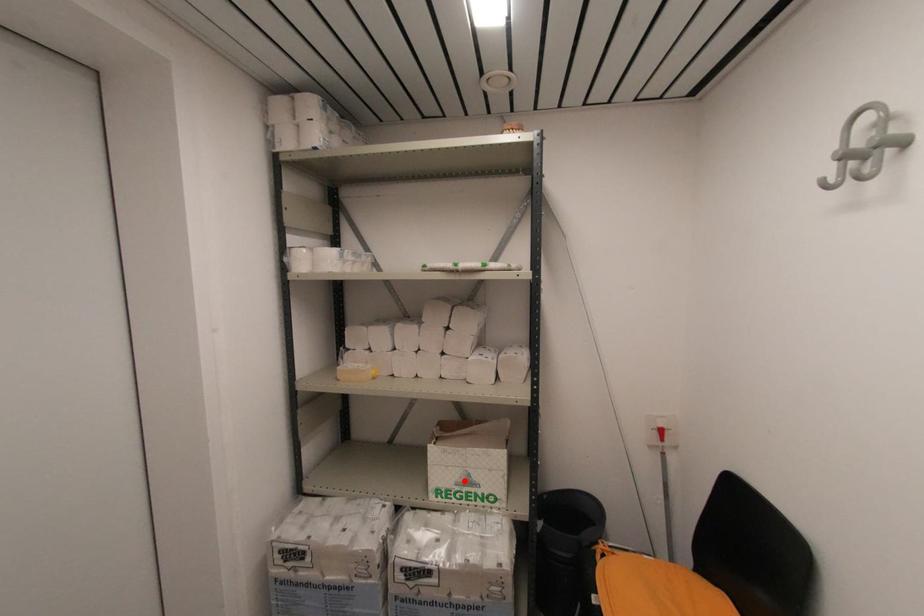
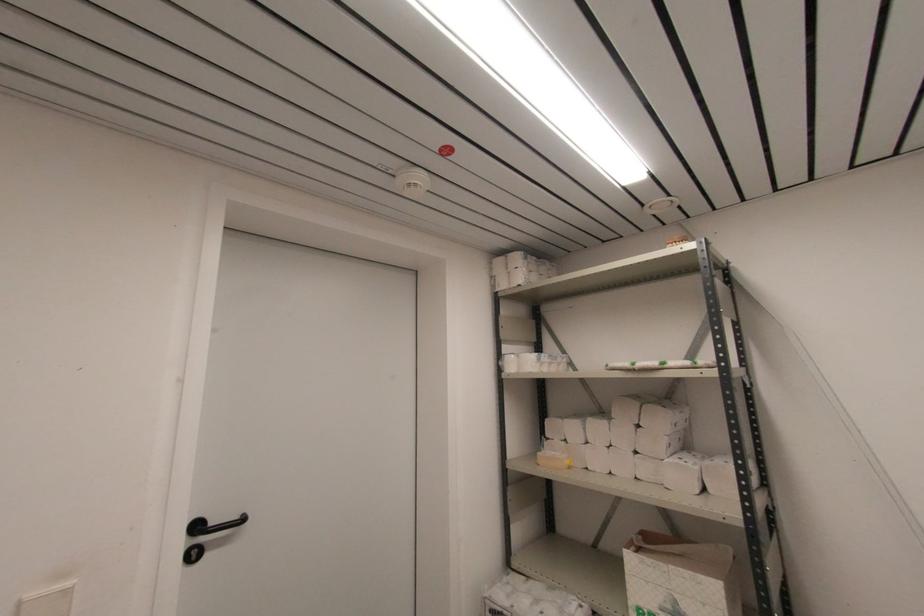
Question: I am providing you with two images of the same scene from different viewpoints. A red point is shown in image1. For the corresponding object point in image2, is it positioned nearer or farther from the camera?

Choices:
 (A) Nearer
 (B) Farther

Answer: (A)